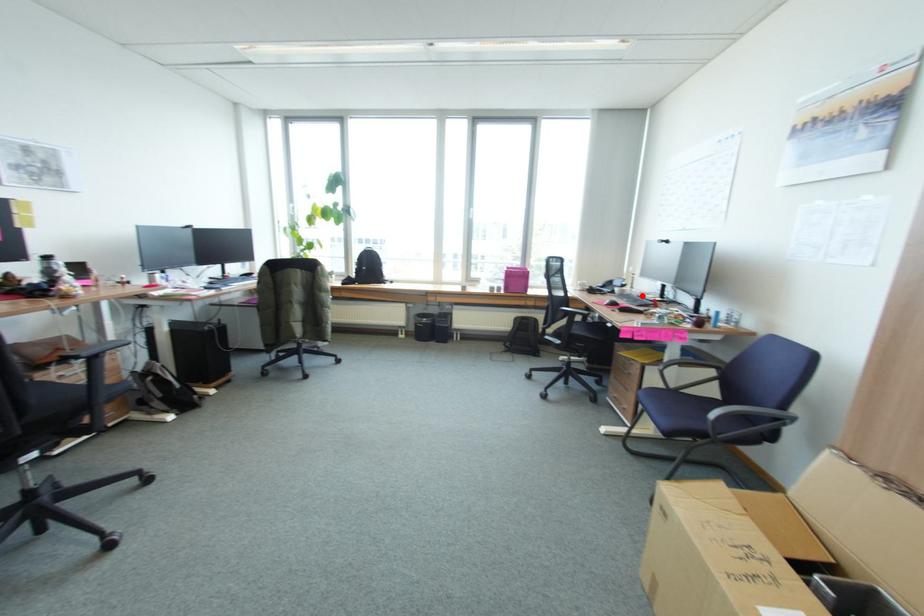
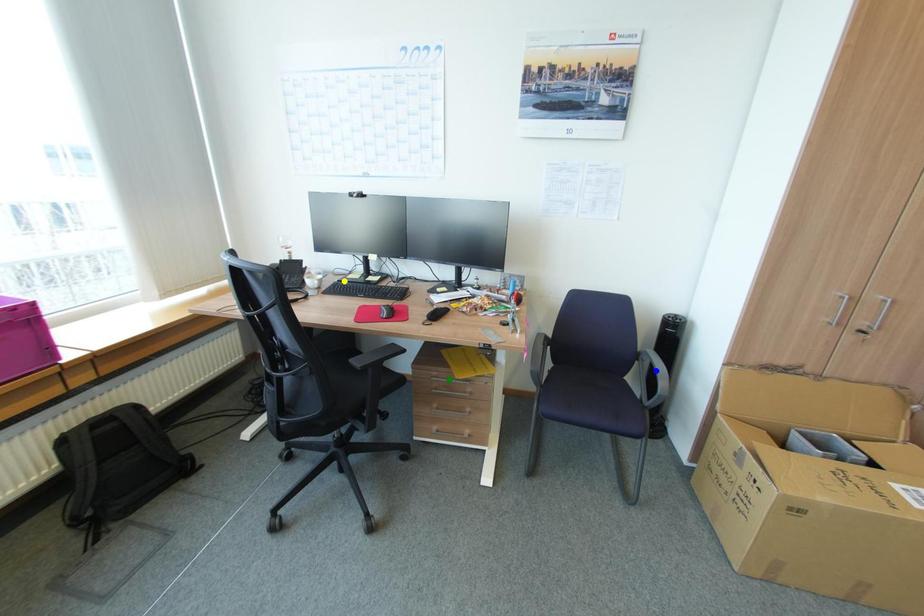
Question: I am providing you with two images of the same scene from different viewpoints. A red point is marked on the first image. You are given multiple points on the second image. Which mark in image 2 goes with the point in image 1?

Choices:
 (A) yellow point
 (B) blue point
 (C) green point

Answer: (A)